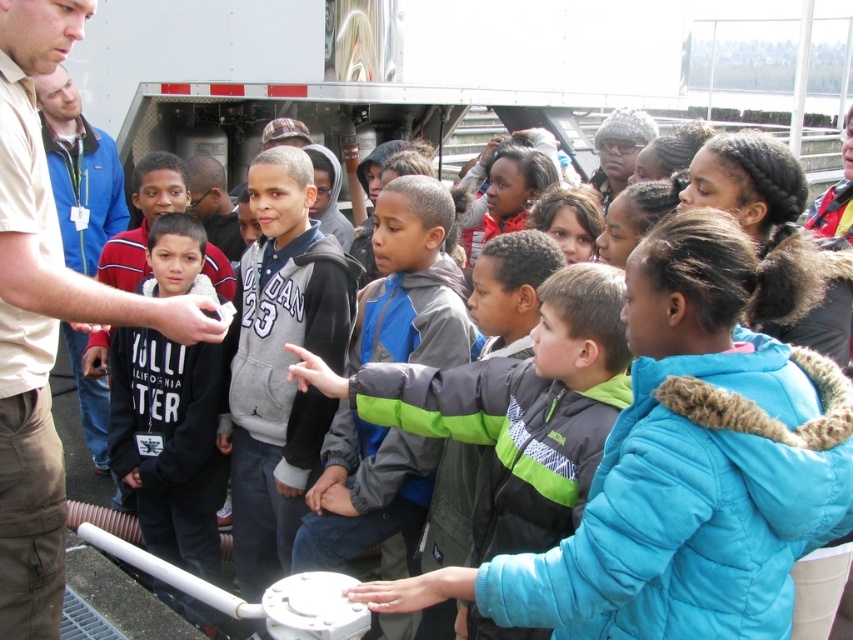
You are a photographer at the event. You want to take a photo that includes both the black fleece jacket at center and the blue jacket at left. Based on their positions, which jacket should be placed lower in the photo to include both in the frame?

The black fleece jacket at center is located below the blue jacket at left, so to include both in the frame, the black fleece jacket at center should be placed lower in the photo.